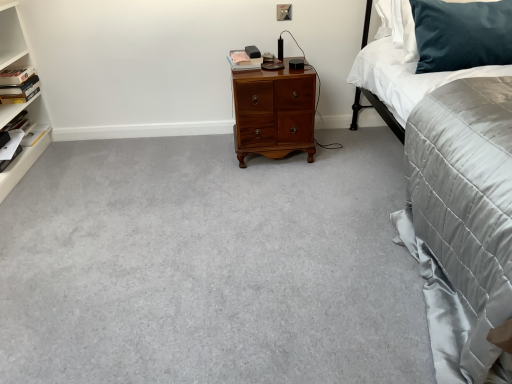
In order to click on free spot to the right of shiny brown wooden nightstand at center in this screenshot , I will do `click(341, 148)`.